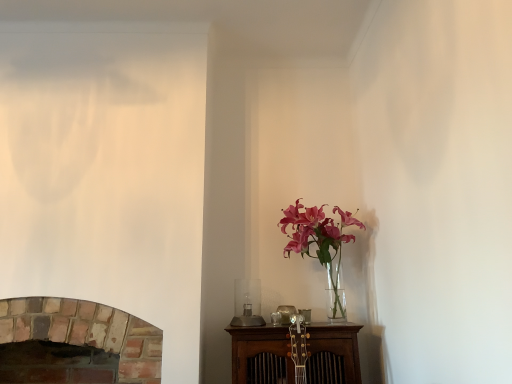
Question: Considering the positions of brick fireplace at lower left and translucent glass vase at upper right in the image, is brick fireplace at lower left taller or shorter than translucent glass vase at upper right?

Choices:
 (A) short
 (B) tall

Answer: (A)

Question: Is point (74, 336) positioned closer to the camera than point (343, 223)?

Choices:
 (A) farther
 (B) closer

Answer: (B)

Question: Considering their positions, is brick fireplace at lower left located in front of or behind translucent glass vase at upper right?

Choices:
 (A) front
 (B) behind

Answer: (A)

Question: From the image's perspective, is translucent glass vase at upper right above or below brick fireplace at lower left?

Choices:
 (A) above
 (B) below

Answer: (A)

Question: In terms of height, does translucent glass vase at upper right look taller or shorter compared to brick fireplace at lower left?

Choices:
 (A) short
 (B) tall

Answer: (B)

Question: Is translucent glass vase at upper right wider or thinner than brick fireplace at lower left?

Choices:
 (A) thin
 (B) wide

Answer: (A)

Question: Considering the positions of translucent glass vase at upper right and brick fireplace at lower left in the image, is translucent glass vase at upper right bigger or smaller than brick fireplace at lower left?

Choices:
 (A) small
 (B) big

Answer: (A)